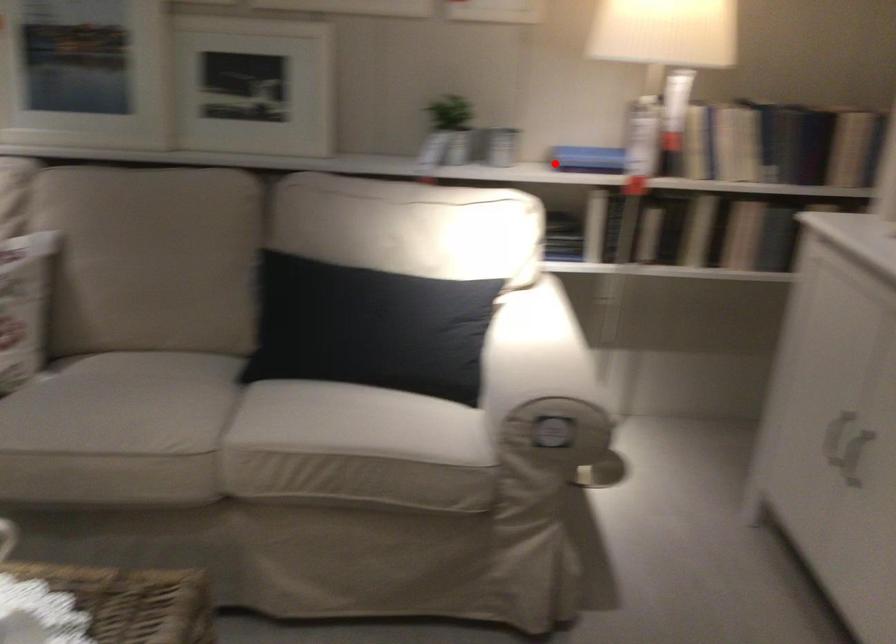
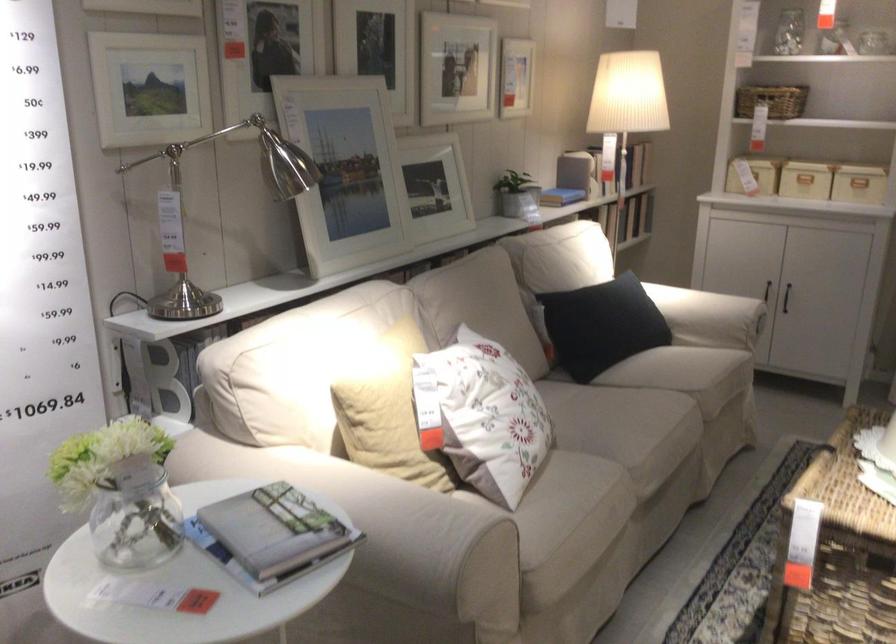
Locate, in the second image, the point that corresponds to the highlighted location in the first image.

(561, 194)